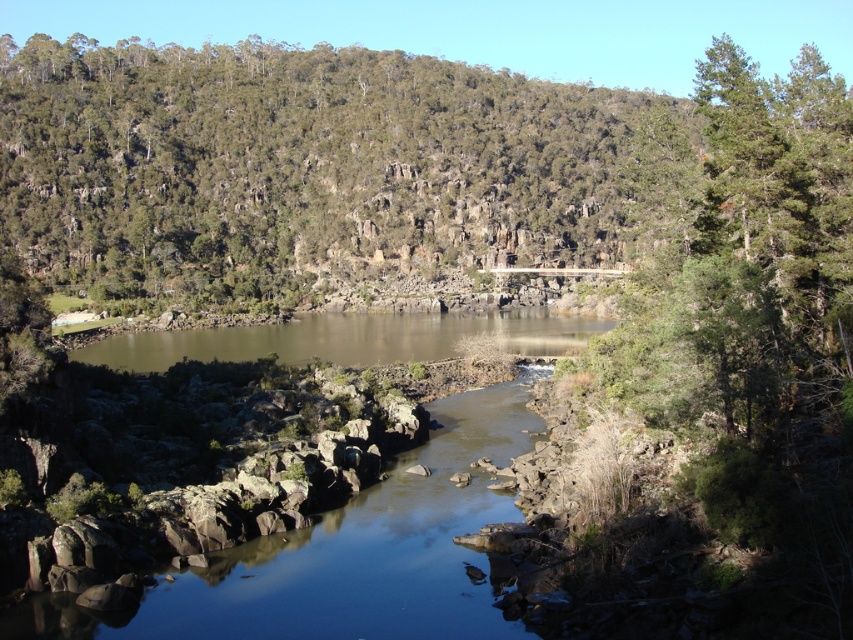
Question: Can you confirm if green leafy tree at upper center is positioned above brown rock river at center?

Choices:
 (A) no
 (B) yes

Answer: (B)

Question: Does green leafy tree at upper center appear under brown rock river at center?

Choices:
 (A) yes
 (B) no

Answer: (B)

Question: Can you confirm if green leafy tree at upper center is wider than brown rock river at center?

Choices:
 (A) no
 (B) yes

Answer: (B)

Question: Which point appears farthest from the camera in this image?

Choices:
 (A) (383, 227)
 (B) (253, 355)

Answer: (A)

Question: Which object appears farthest from the camera in this image?

Choices:
 (A) brown rock river at center
 (B) green leafy tree at upper center

Answer: (A)